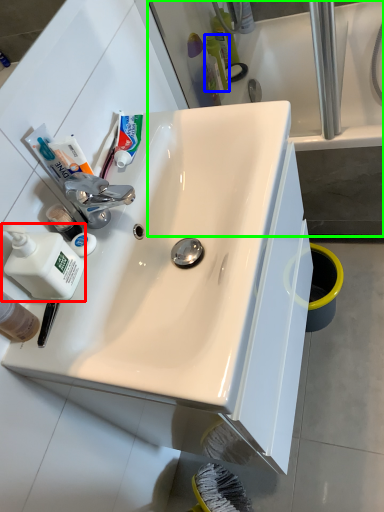
Question: Considering the real-world distances, which object is closest to cleaning product (highlighted by a red box)? toiletry (highlighted by a blue box) or bath (highlighted by a green box).

Choices:
 (A) toiletry
 (B) bath

Answer: (B)